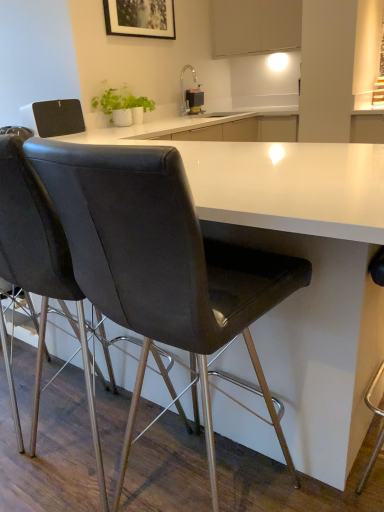
Question: Does metallic black soap dispenser at upper center have a greater height compared to white matte cabinet at upper center?

Choices:
 (A) no
 (B) yes

Answer: (A)

Question: From the image's perspective, is metallic black soap dispenser at upper center above white matte cabinet at upper center?

Choices:
 (A) no
 (B) yes

Answer: (A)

Question: Does metallic black soap dispenser at upper center have a larger size compared to white matte cabinet at upper center?

Choices:
 (A) yes
 (B) no

Answer: (B)

Question: From the image's perspective, would you say metallic black soap dispenser at upper center is shown under white matte cabinet at upper center?

Choices:
 (A) no
 (B) yes

Answer: (B)

Question: Is metallic black soap dispenser at upper center behind white matte cabinet at upper center?

Choices:
 (A) no
 (B) yes

Answer: (B)

Question: Do you think matte black chair at center, the first chair positioned from the left, is within white matte cabinet at upper center, or outside of it?

Choices:
 (A) outside
 (B) inside

Answer: (A)

Question: In terms of size, does matte black chair at center, the first chair positioned from the left, appear bigger or smaller than white matte cabinet at upper center?

Choices:
 (A) small
 (B) big

Answer: (B)

Question: Based on their positions, is matte black chair at center, the first chair positioned from the left, located to the left or right of white matte cabinet at upper center?

Choices:
 (A) right
 (B) left

Answer: (B)

Question: From the image's perspective, is matte black chair at center, the 2th chair from the right, positioned above or below white matte cabinet at upper center?

Choices:
 (A) above
 (B) below

Answer: (B)

Question: Based on their positions, is matte black chair at center, the first chair positioned from the left, located to the left or right of matte black picture frame at upper center?

Choices:
 (A) right
 (B) left

Answer: (B)

Question: In terms of width, does matte black chair at center, the first chair positioned from the left, look wider or thinner when compared to matte black picture frame at upper center?

Choices:
 (A) thin
 (B) wide

Answer: (B)

Question: Relative to matte black picture frame at upper center, is matte black chair at center, the first chair positioned from the left, in front or behind?

Choices:
 (A) behind
 (B) front

Answer: (B)

Question: Which is correct: matte black chair at center, the first chair positioned from the left, is inside matte black picture frame at upper center, or outside of it?

Choices:
 (A) outside
 (B) inside

Answer: (A)

Question: Is matte black picture frame at upper center to the left or to the right of white matte cabinet at upper center in the image?

Choices:
 (A) left
 (B) right

Answer: (A)

Question: Is matte black picture frame at upper center in front of or behind white matte cabinet at upper center in the image?

Choices:
 (A) front
 (B) behind

Answer: (A)